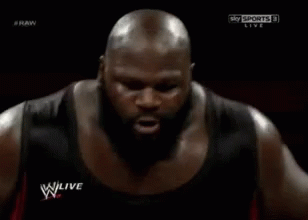
The image size is (308, 220). What are the coordinates of `mat` in the screenshot? It's located at (128, 105).